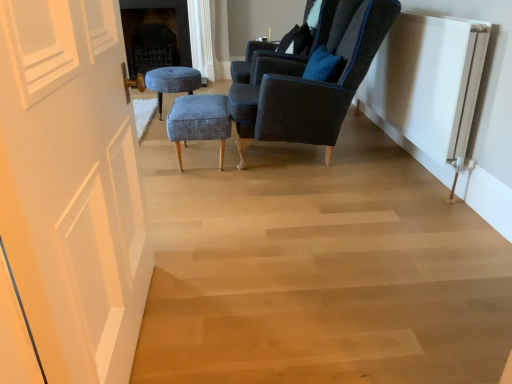
Question: Is white ribbed radiator at right to the right of velvet dark blue armchair at upper right, the 2th chair from the front, from the viewer's perspective?

Choices:
 (A) no
 (B) yes

Answer: (B)

Question: Is white ribbed radiator at right shorter than velvet dark blue armchair at upper right, positioned as the first chair in back-to-front order?

Choices:
 (A) yes
 (B) no

Answer: (B)

Question: From the image's perspective, is white ribbed radiator at right under velvet dark blue armchair at upper right, the 2th chair from the front?

Choices:
 (A) yes
 (B) no

Answer: (A)

Question: Is white ribbed radiator at right further to the viewer compared to velvet dark blue armchair at upper right, positioned as the first chair in back-to-front order?

Choices:
 (A) no
 (B) yes

Answer: (A)

Question: From the image's perspective, does white ribbed radiator at right appear higher than velvet dark blue armchair at upper right, positioned as the first chair in back-to-front order?

Choices:
 (A) yes
 (B) no

Answer: (B)

Question: From their relative heights in the image, would you say blue fabric stool at center, positioned as the 2th stool in back-to-front order, is taller or shorter than velvet dark blue armchair at upper right, positioned as the first chair in back-to-front order?

Choices:
 (A) short
 (B) tall

Answer: (A)

Question: From a real-world perspective, is blue fabric stool at center, marked as the first stool in a front-to-back arrangement, physically located above or below velvet dark blue armchair at upper right, positioned as the first chair in back-to-front order?

Choices:
 (A) above
 (B) below

Answer: (B)

Question: Looking at their shapes, would you say blue fabric stool at center, acting as the second stool starting from the top, is wider or thinner than velvet dark blue armchair at upper right, the 2th chair from the front?

Choices:
 (A) wide
 (B) thin

Answer: (B)

Question: Relative to velvet dark blue armchair at upper right, positioned as the first chair in back-to-front order, is blue fabric stool at center, arranged as the first stool when viewed from the right, in front or behind?

Choices:
 (A) front
 (B) behind

Answer: (A)

Question: Is blue fabric stool at center, the 1th stool when ordered from bottom to top, taller or shorter than velvet dark blue armchair at center, marked as the second chair in a back-to-front arrangement?

Choices:
 (A) short
 (B) tall

Answer: (A)

Question: Considering the positions of blue fabric stool at center, marked as the first stool in a front-to-back arrangement, and velvet dark blue armchair at center, marked as the second chair in a back-to-front arrangement, in the image, is blue fabric stool at center, marked as the first stool in a front-to-back arrangement, wider or thinner than velvet dark blue armchair at center, marked as the second chair in a back-to-front arrangement,?

Choices:
 (A) thin
 (B) wide

Answer: (A)

Question: Is blue fabric stool at center, the 1th stool when ordered from bottom to top, bigger or smaller than velvet dark blue armchair at center, the 1th chair viewed from the front?

Choices:
 (A) small
 (B) big

Answer: (A)

Question: From the image's perspective, relative to velvet dark blue armchair at center, marked as the second chair in a back-to-front arrangement, is blue fabric stool at center, marked as the first stool in a front-to-back arrangement, above or below?

Choices:
 (A) below
 (B) above

Answer: (A)

Question: From the image's perspective, is velvet dark blue armchair at upper right, the 2th chair from the front, above or below white ribbed radiator at right?

Choices:
 (A) below
 (B) above

Answer: (B)

Question: In terms of height, does velvet dark blue armchair at upper right, positioned as the first chair in back-to-front order, look taller or shorter compared to white ribbed radiator at right?

Choices:
 (A) short
 (B) tall

Answer: (A)